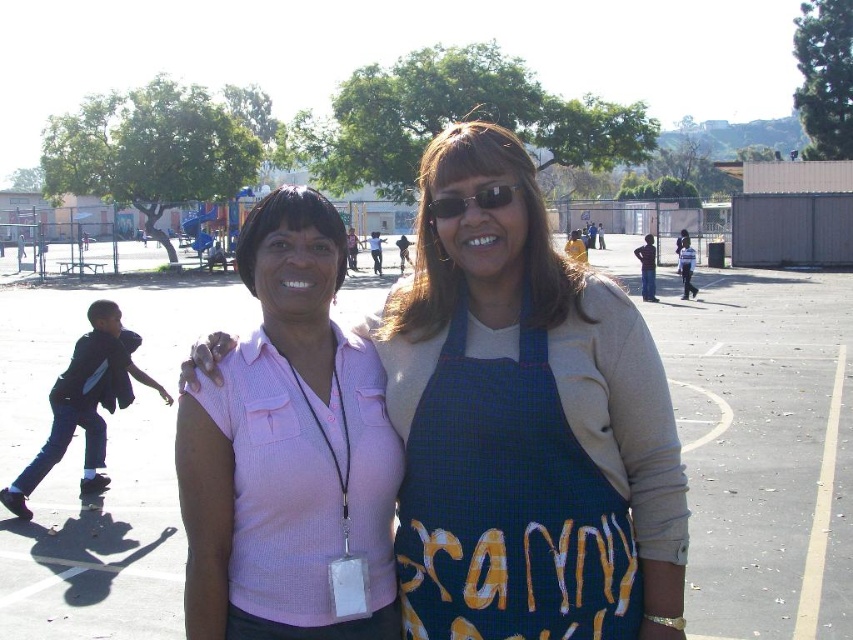
Question: Can you confirm if pink ribbed shirt at center is positioned above sunglasses at center?

Choices:
 (A) yes
 (B) no

Answer: (B)

Question: Which object appears farthest from the camera in this image?

Choices:
 (A) pink ribbed shirt at center
 (B) sunglasses at center

Answer: (B)

Question: Can you confirm if pink ribbed shirt at center is smaller than sunglasses at center?

Choices:
 (A) no
 (B) yes

Answer: (A)

Question: Can you confirm if gray asphalt parking lot at center is positioned above blue checkered apron at center?

Choices:
 (A) yes
 (B) no

Answer: (A)

Question: Which of the following is the closest to the observer?

Choices:
 (A) gray asphalt parking lot at center
 (B) blue checkered apron at center
 (C) sunglasses at center
 (D) pink ribbed shirt at center

Answer: (B)

Question: Considering the real-world distances, which object is closest to the pink ribbed shirt at center?

Choices:
 (A) blue checkered apron at center
 (B) gray asphalt parking lot at center
 (C) sunglasses at center

Answer: (A)